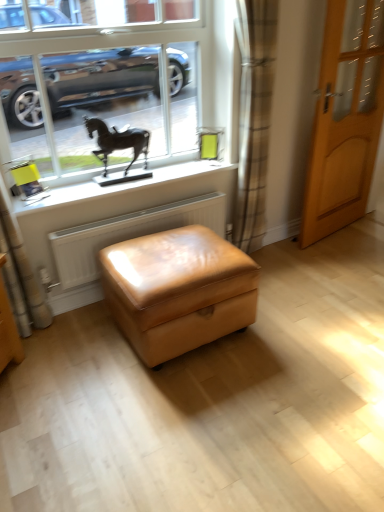
I want to click on free space to the right of plaid fabric curtain at center, so click(289, 258).